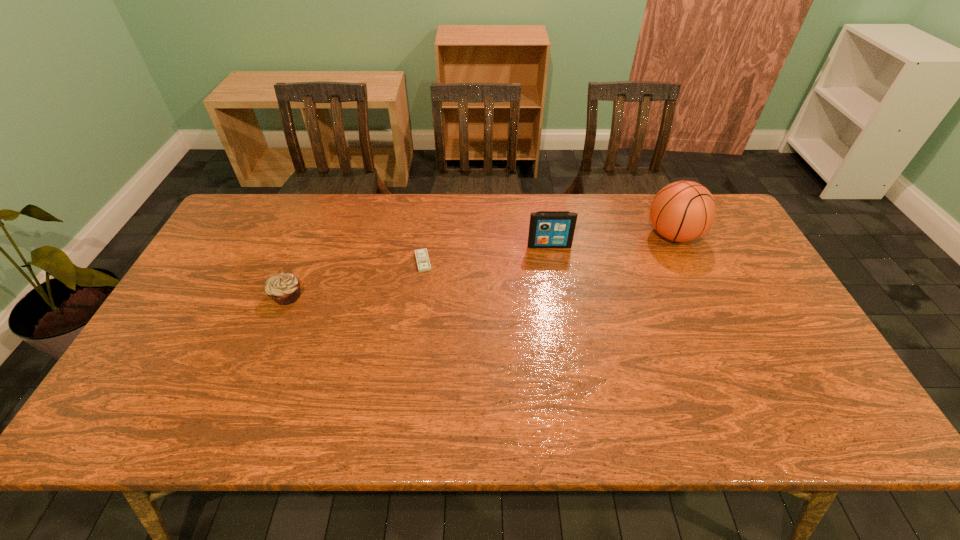
Where is `the third closest object to the second tallest object`? the third closest object to the second tallest object is located at coordinates (284, 289).

Identify which object is located as the second nearest to the tallest object. Please provide its 2D coordinates. Your answer should be formatted as a tuple, i.e. [(x, y)], where the tuple contains the x and y coordinates of a point satisfying the conditions above.

[(422, 258)]

At what (x,y) coordinates should I click in order to perform the action: click on vacant space that satisfies the following two spatial constraints: 1. on the back side of the tallest object; 2. on the right side of the second object from left to right. Please return your answer as a coordinate pair (x, y). Looking at the image, I should click on (426, 235).

You are a GUI agent. You are given a task and a screenshot of the screen. Output one action in this format:
    pyautogui.click(x=<x>, y=<y>)
    Task: Click on the vacant point that satisfies the following two spatial constraints: 1. on the back side of the rightmost object; 2. on the right side of the muffin
    This screenshot has height=540, width=960.
    Given the screenshot: What is the action you would take?
    pyautogui.click(x=312, y=235)

Identify the location of vacant space that satisfies the following two spatial constraints: 1. on the back side of the rightmost object; 2. on the right side of the muffin. (312, 235).